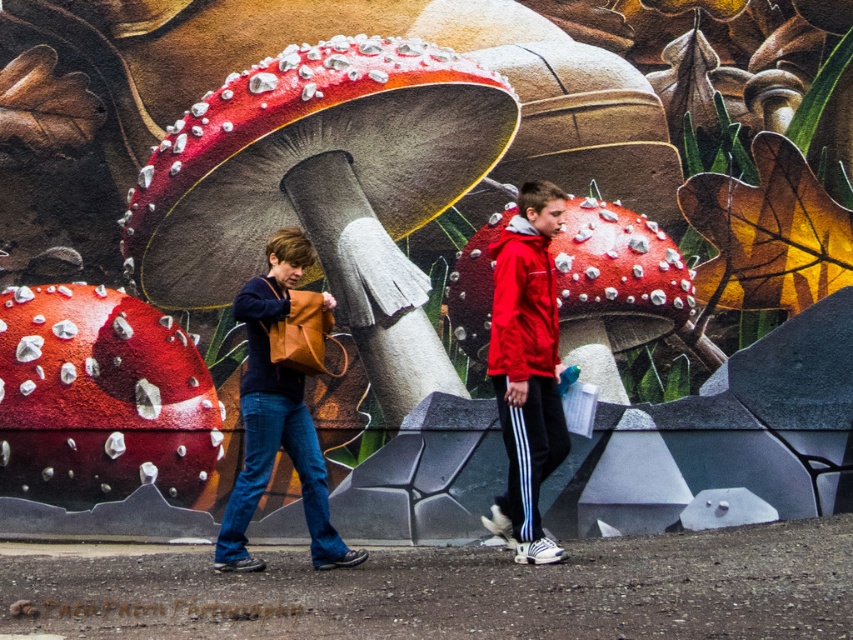
Is point (506, 500) farther from camera compared to point (521, 321)?

That is True.

This screenshot has width=853, height=640. In order to click on matte brown leather bag at left in this screenshot , I will do `click(527, 369)`.

Identify the location of matte brown leather bag at left. (527, 369).

Locate an element on the screen. This screenshot has width=853, height=640. matte brown leather bag at left is located at coordinates (527, 369).

Is matte brown leather bag at left in front of matte brown leather bag at center-left?

Yes, it is.

Does point (526, 480) lie behind point (271, 378)?

No, it is not.

Where is `matte brown leather bag at left`? This screenshot has width=853, height=640. matte brown leather bag at left is located at coordinates (527, 369).

Is point (527, 563) positioned in front of point (531, 284)?

Yes, it is.

Which is below, red matte jacket at center or matte red jacket at center?

red matte jacket at center is lower down.

What do you see at coordinates (527, 369) in the screenshot? I see `red matte jacket at center` at bounding box center [527, 369].

Where is `red matte jacket at center`? The image size is (853, 640). red matte jacket at center is located at coordinates (527, 369).